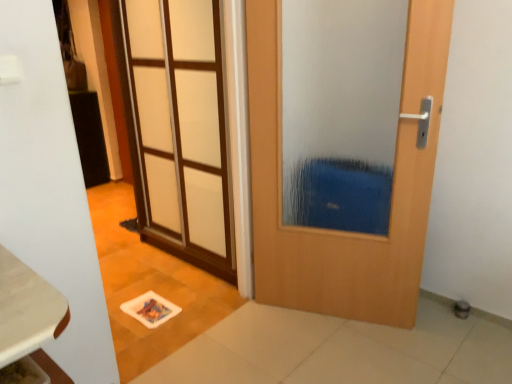
Question: Is white frosted glass door at upper left, which is counted as the first door, starting from the left, at the right side of wooden door at center, which is counted as the first door, starting from the right?

Choices:
 (A) yes
 (B) no

Answer: (B)

Question: Is white frosted glass door at upper left, which is counted as the first door, starting from the left, not near wooden door at center, the second door viewed from the left?

Choices:
 (A) yes
 (B) no

Answer: (B)

Question: Would you say wooden door at center, which is counted as the first door, starting from the right, is part of white frosted glass door at upper left, which is counted as the first door, starting from the left,'s contents?

Choices:
 (A) no
 (B) yes

Answer: (A)

Question: Can you confirm if white frosted glass door at upper left, which is counted as the first door, starting from the left, is wider than wooden door at center, the second door viewed from the left?

Choices:
 (A) yes
 (B) no

Answer: (B)

Question: Considering the relative sizes of white frosted glass door at upper left, which is counted as the 2th door, starting from the right, and wooden door at center, the second door viewed from the left, in the image provided, is white frosted glass door at upper left, which is counted as the 2th door, starting from the right, shorter than wooden door at center, the second door viewed from the left,?

Choices:
 (A) yes
 (B) no

Answer: (B)

Question: Is wooden table at lower left bigger or smaller than wooden door at center, which is counted as the first door, starting from the right?

Choices:
 (A) small
 (B) big

Answer: (A)

Question: Is wooden table at lower left taller or shorter than wooden door at center, which is counted as the first door, starting from the right?

Choices:
 (A) tall
 (B) short

Answer: (B)

Question: Does point (31, 301) appear closer or farther from the camera than point (357, 243)?

Choices:
 (A) closer
 (B) farther

Answer: (A)

Question: Considering the positions of wooden table at lower left and wooden door at center, the second door viewed from the left, in the image, is wooden table at lower left wider or thinner than wooden door at center, the second door viewed from the left,?

Choices:
 (A) thin
 (B) wide

Answer: (B)

Question: Is white frosted glass door at upper left, which is counted as the first door, starting from the left, wider or thinner than wooden door at center, the second door viewed from the left?

Choices:
 (A) wide
 (B) thin

Answer: (B)

Question: Is white frosted glass door at upper left, which is counted as the first door, starting from the left, situated inside wooden door at center, which is counted as the first door, starting from the right, or outside?

Choices:
 (A) outside
 (B) inside

Answer: (A)

Question: Is white frosted glass door at upper left, which is counted as the 2th door, starting from the right, in front of or behind wooden door at center, which is counted as the first door, starting from the right, in the image?

Choices:
 (A) front
 (B) behind

Answer: (B)

Question: From a real-world perspective, relative to wooden door at center, the second door viewed from the left, is white frosted glass door at upper left, which is counted as the 2th door, starting from the right, vertically above or below?

Choices:
 (A) below
 (B) above

Answer: (B)

Question: Looking at their shapes, would you say wooden door at center, which is counted as the first door, starting from the right, is wider or thinner than white frosted glass door at upper left, which is counted as the first door, starting from the left?

Choices:
 (A) thin
 (B) wide

Answer: (B)

Question: From a real-world perspective, is wooden door at center, which is counted as the first door, starting from the right, above or below white frosted glass door at upper left, which is counted as the 2th door, starting from the right?

Choices:
 (A) above
 (B) below

Answer: (B)